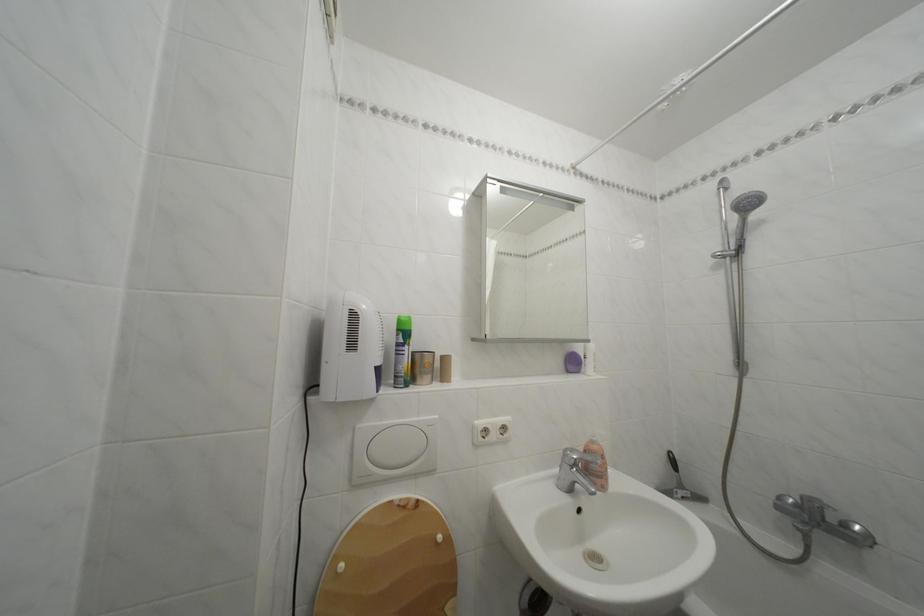
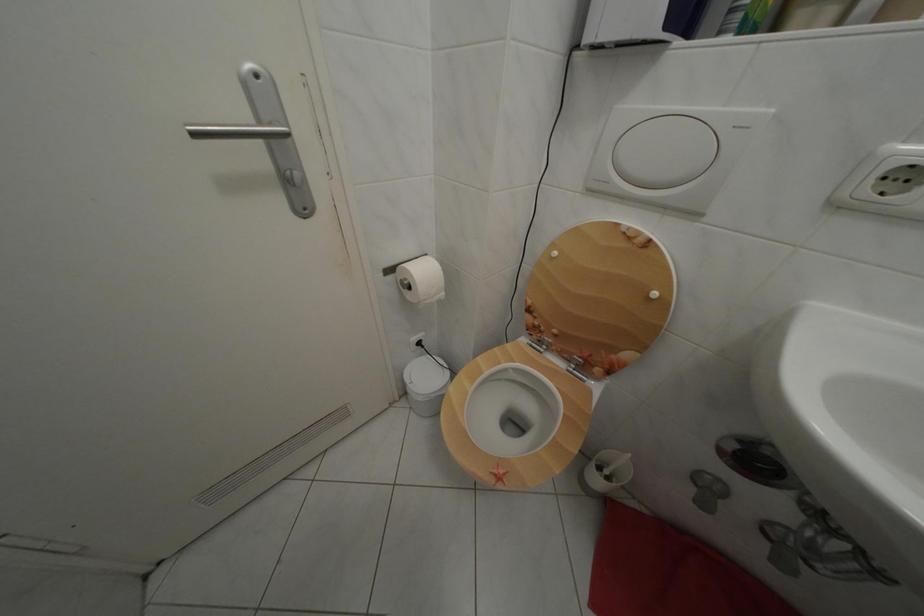
First-person continuous shooting, in which direction is the camera rotating?

The camera rotated toward left-down.